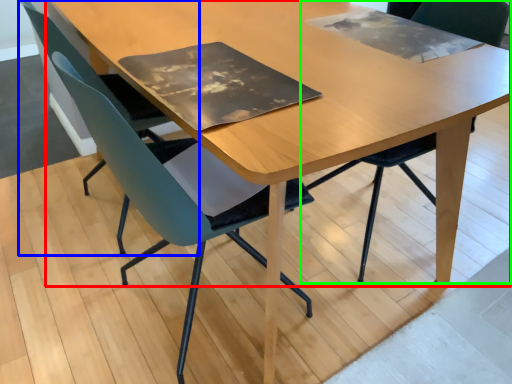
Question: Which object is positioned farthest from table (highlighted by a red box)? Select from chair (highlighted by a blue box) and chair (highlighted by a green box).

Choices:
 (A) chair
 (B) chair

Answer: (B)